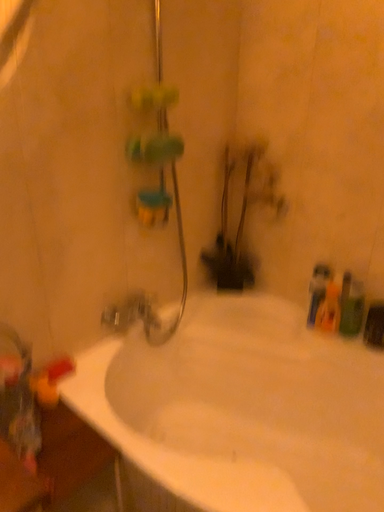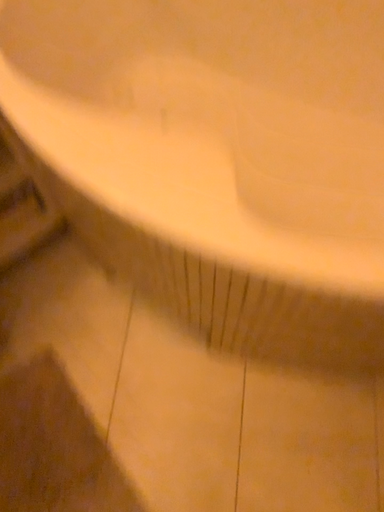
Question: Which way did the camera rotate in the video?

Choices:
 (A) rotated right
 (B) rotated left

Answer: (B)